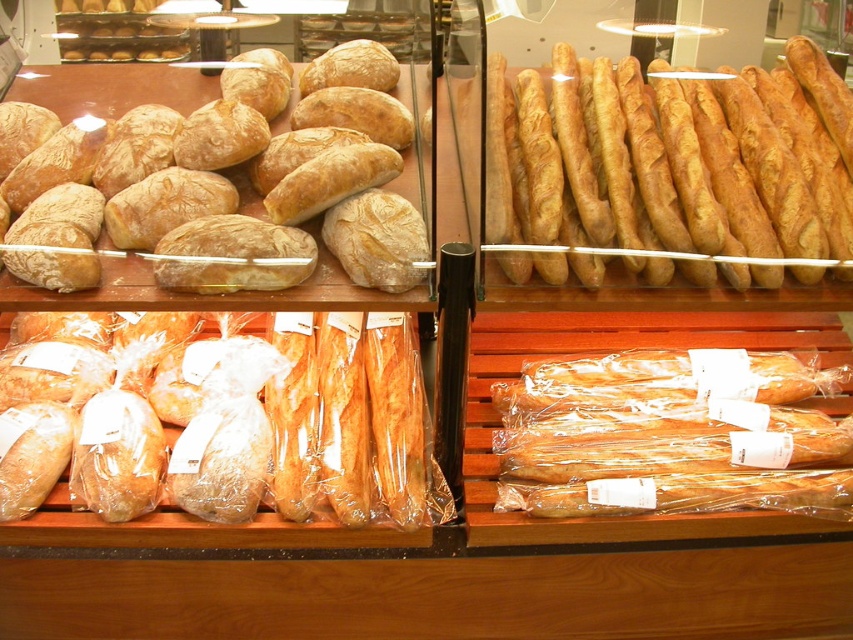
You are a customer at the bakery and want to choose a bread that is taller. Which one should you pick between the golden crispy baguette at lower right and the matte brown loaf at upper left?

The matte brown loaf at upper left is taller than the golden crispy baguette at lower right, so you should pick the matte brown loaf at upper left.

You are a customer at the bakery and want to grab both the golden crispy baguette at lower right and the matte brown loaf at upper left. Which one would you reach for first without moving your position?

You would reach for the golden crispy baguette at lower right first because it is positioned under the matte brown loaf at upper left, making it closer to your hand.

You are a customer looking at the bakery display. You want to grab a baguette from the lower shelf and one from the upper shelf. Which golden brown baguette at lower left is positioned below the golden crispy baguette at upper right?

The golden brown baguette at lower left is located below the golden crispy baguette at upper right, so you can easily reach both by first taking the one below and then the one above.